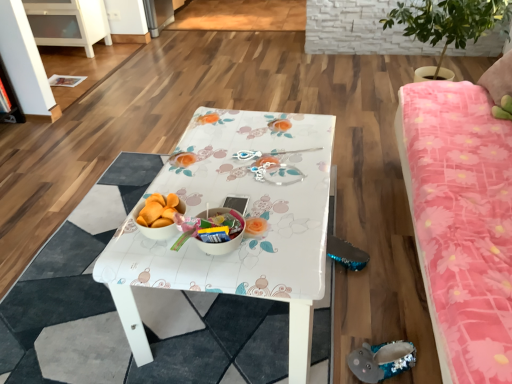
Identify the location of vacant space situated above white glossy table at center (from a real-world perspective). (243, 171).